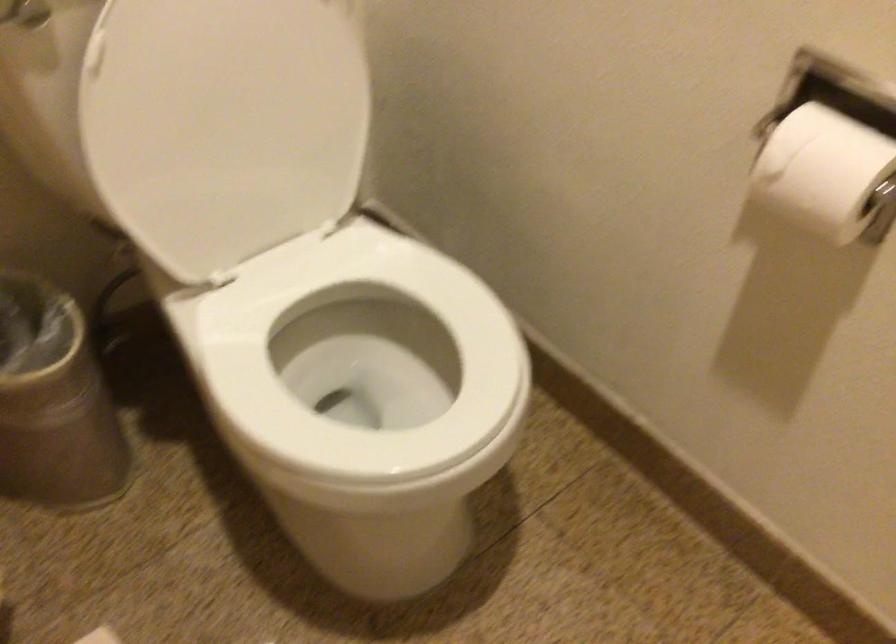
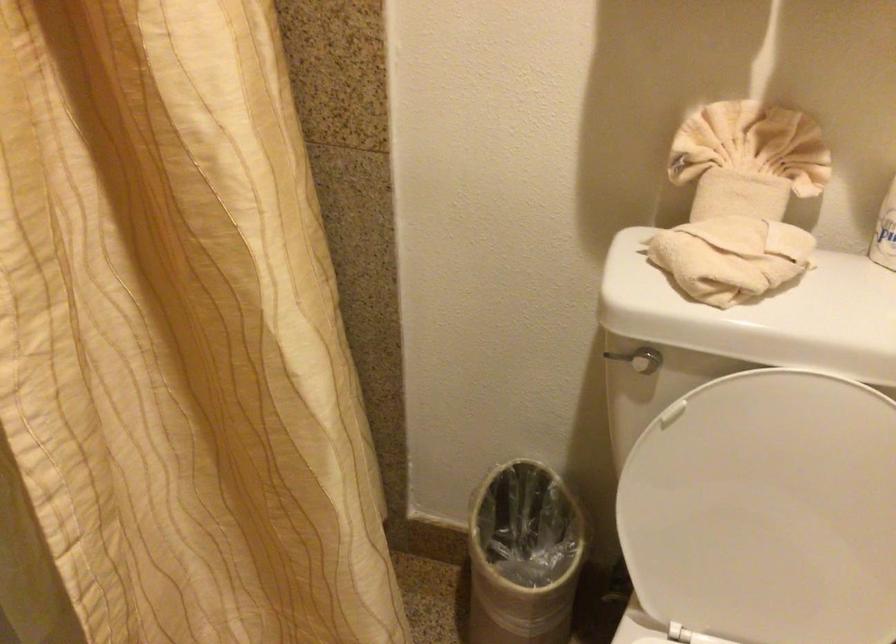
Question: The images are taken continuously from a first-person perspective. In which direction is your viewpoint rotating?

Choices:
 (A) Left
 (B) Right
 (C) Up
 (D) Down

Answer: (A)